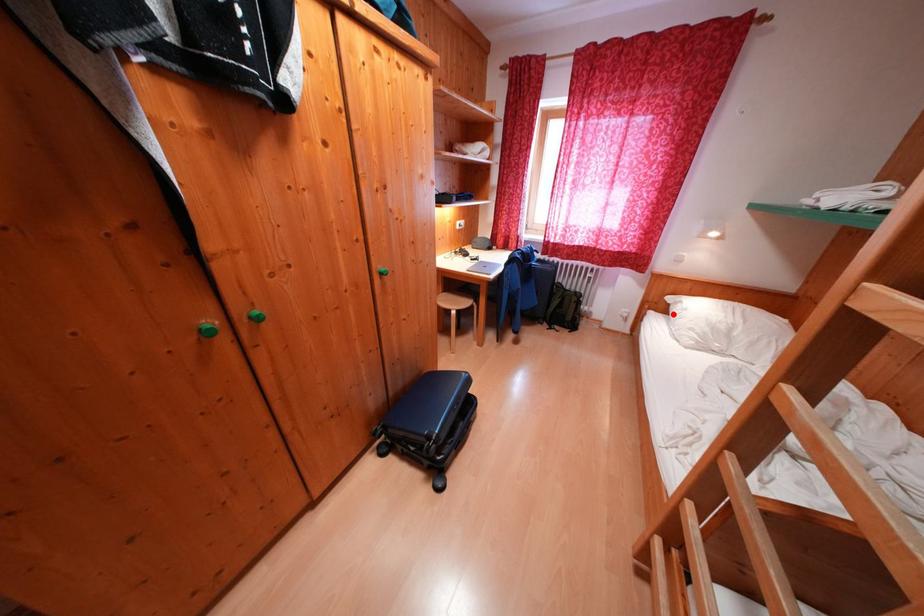
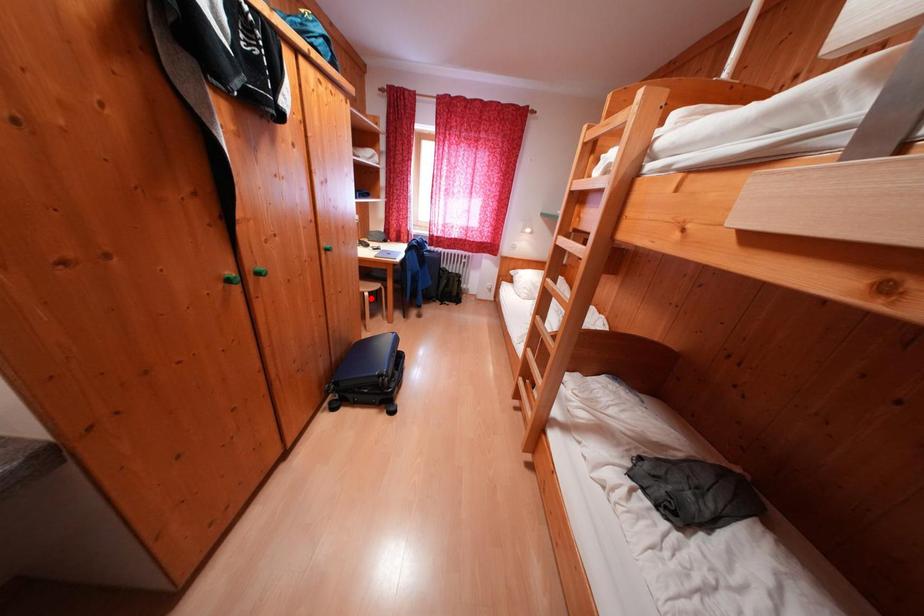
I am providing you with two images of the same scene from different viewpoints. A red point is marked on the first image and another point is marked on the second image. Is the marked point in image1 the same physical position as the marked point in image2?

No